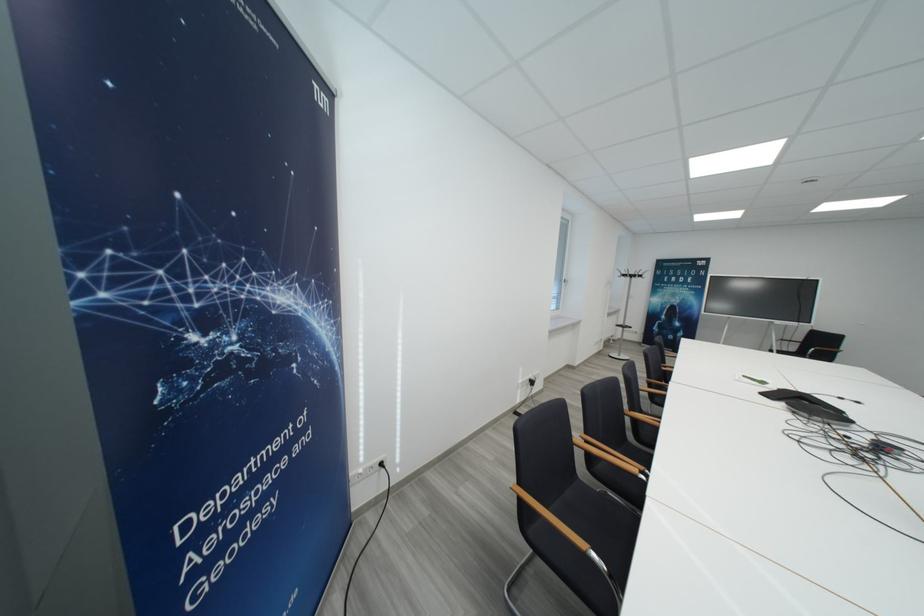
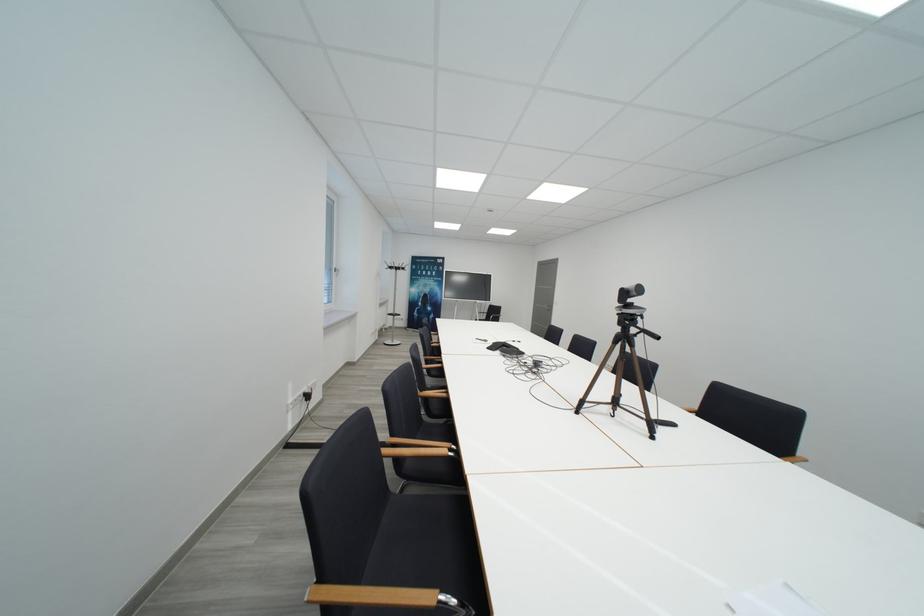
Locate, in the second image, the point that corresponds to (x=535, y=381) in the first image.

(309, 395)